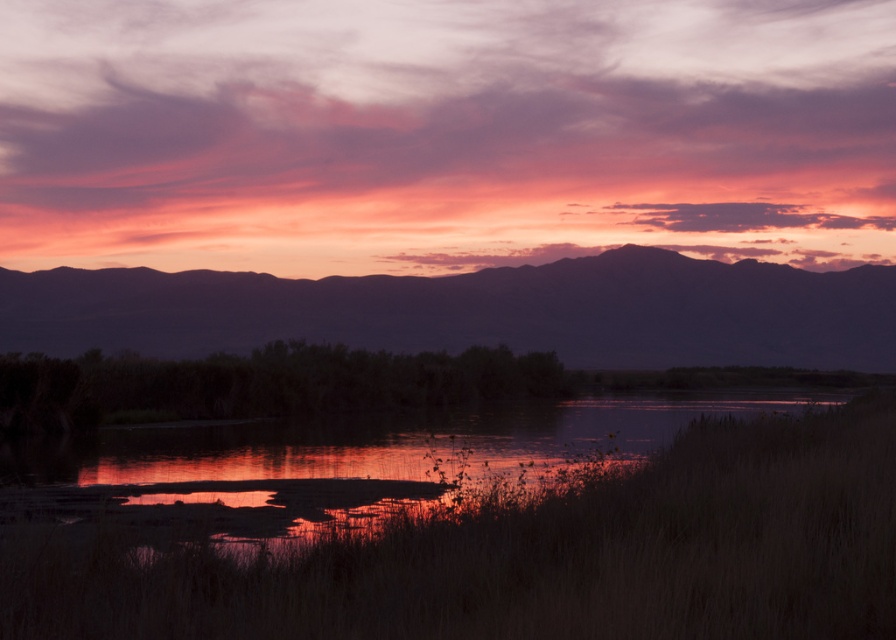
You are a photographer planning to capture the sunset scene. You have two subjects in view, the silvery metallic mountain at upper center and the reflective wetland at center. Which object should you focus on if you want to highlight something taller in your composition?

The silvery metallic mountain at upper center is taller than the reflective wetland at center, so focusing on it would highlight the taller subject in your composition.

You are an artist painting the sunset scene. You want to ensure the silvery metallic mountain at upper center and the reflective wetland at center are positioned correctly. Which object is located to the right of the other?

The silvery metallic mountain at upper center is to the right of reflective wetland at center.

You are standing at the edge of the water in the sunset scene. You notice a point marked at coordinates (477,310). Based on the scene description, can you identify what this point is located on?

The point at (477,310) is located on the silvery metallic mountain at upper center.